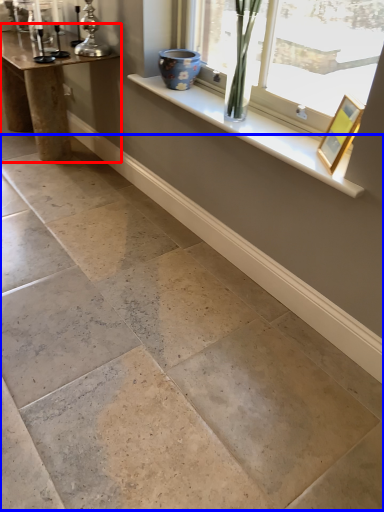
Question: Among these objects, which one is nearest to the camera, table (highlighted by a red box) or concrete (highlighted by a blue box)?

Choices:
 (A) table
 (B) concrete

Answer: (B)